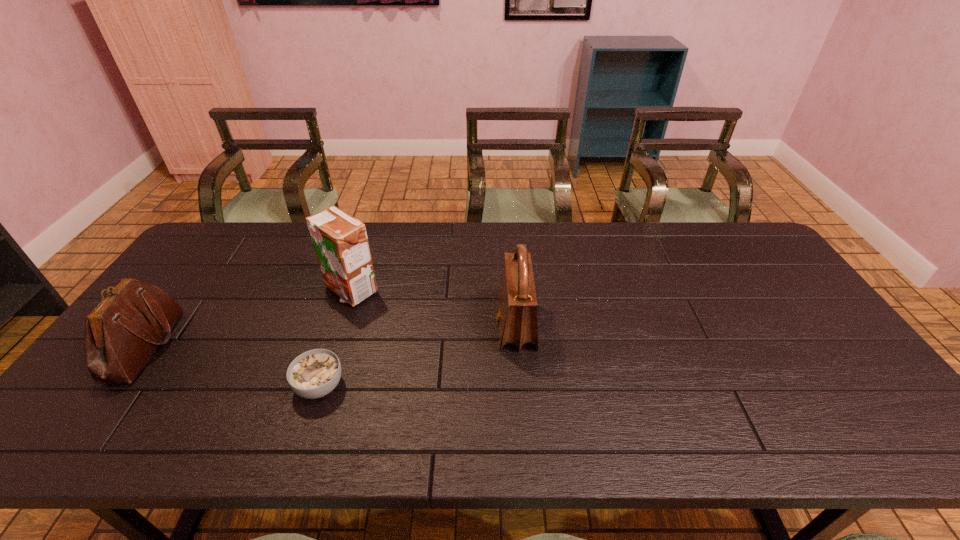
The height and width of the screenshot is (540, 960). I want to click on blank region between the right shoulder bag and the soup bowl, so (x=418, y=356).

At what (x,y) coordinates should I click in order to perform the action: click on free point between the shorter shoulder bag and the taller shoulder bag. Please return your answer as a coordinate pair (x, y). The width and height of the screenshot is (960, 540). Looking at the image, I should click on (330, 335).

Identify the location of vacant area that lies between the carton and the shorter shoulder bag. This screenshot has height=540, width=960. (248, 318).

The image size is (960, 540). I want to click on vacant space that is in between the carton and the shorter shoulder bag, so click(x=248, y=318).

The height and width of the screenshot is (540, 960). Identify the location of empty location between the right shoulder bag and the shorter shoulder bag. (330, 335).

At what (x,y) coordinates should I click in order to perform the action: click on empty location between the left shoulder bag and the rightmost object. Please return your answer as a coordinate pair (x, y). Looking at the image, I should click on (330, 335).

I want to click on vacant area between the shortest object and the third tallest object, so click(232, 366).

Identify the location of object that stands as the second closest to the soup bowl. (122, 332).

Identify which object is the closest to the shortest object. Please provide its 2D coordinates. Your answer should be formatted as a tuple, i.e. [(x, y)], where the tuple contains the x and y coordinates of a point satisfying the conditions above.

[(340, 241)]

You are a GUI agent. You are given a task and a screenshot of the screen. Output one action in this format:
    pyautogui.click(x=<x>, y=<y>)
    Task: Click on the free location that satisfies the following two spatial constraints: 1. on the straw side of the soup bowl; 2. on the left side of the carton
    
    Given the screenshot: What is the action you would take?
    pyautogui.click(x=320, y=386)